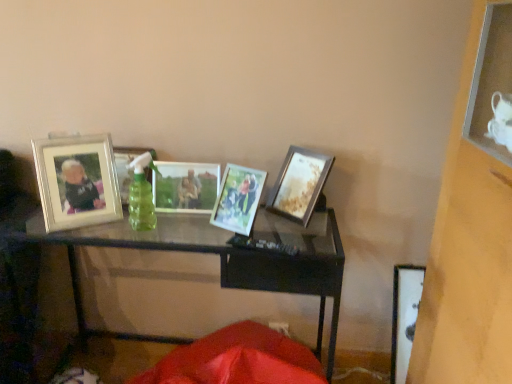
Question: Is the depth of wooden photo frame at center, the 1th picture frame when ordered from right to left, greater than that of metallic silver photo frame at center, which is the 3th picture frame from left to right?

Choices:
 (A) yes
 (B) no

Answer: (B)

Question: Can you confirm if wooden photo frame at center, the 1th picture frame when ordered from right to left, is positioned to the right of metallic silver photo frame at center, which is the 3th picture frame from left to right?

Choices:
 (A) no
 (B) yes

Answer: (B)

Question: Is wooden photo frame at center, the fifth picture frame positioned from the left, thinner than metallic silver photo frame at center, which is the 3th picture frame from left to right?

Choices:
 (A) yes
 (B) no

Answer: (B)

Question: From a real-world perspective, is wooden photo frame at center, the 1th picture frame when ordered from right to left, over metallic silver photo frame at center, which is the 3th picture frame from left to right?

Choices:
 (A) yes
 (B) no

Answer: (A)

Question: From the image's perspective, is wooden photo frame at center, the 1th picture frame when ordered from right to left, on top of metallic silver photo frame at center, positioned as the 3th picture frame in right-to-left order?

Choices:
 (A) no
 (B) yes

Answer: (B)

Question: Is wooden photo frame at center, the fifth picture frame positioned from the left, shorter than metallic silver photo frame at center, which is the 3th picture frame from left to right?

Choices:
 (A) no
 (B) yes

Answer: (A)

Question: Does black glass table at center lie in front of metallic silver photo frame at center, which is the 3th picture frame from left to right?

Choices:
 (A) yes
 (B) no

Answer: (A)

Question: From the image's perspective, does black glass table at center appear higher than metallic silver photo frame at center, which is the 3th picture frame from left to right?

Choices:
 (A) no
 (B) yes

Answer: (A)

Question: Is the depth of black glass table at center greater than that of metallic silver photo frame at center, which is the 3th picture frame from left to right?

Choices:
 (A) no
 (B) yes

Answer: (A)

Question: Considering the relative sizes of black glass table at center and metallic silver photo frame at center, positioned as the 3th picture frame in right-to-left order, in the image provided, is black glass table at center wider than metallic silver photo frame at center, positioned as the 3th picture frame in right-to-left order,?

Choices:
 (A) no
 (B) yes

Answer: (B)

Question: Does black glass table at center turn towards metallic silver photo frame at center, which is the 3th picture frame from left to right?

Choices:
 (A) yes
 (B) no

Answer: (B)

Question: Would you say black glass table at center contains metallic silver photo frame at center, which is the 3th picture frame from left to right?

Choices:
 (A) no
 (B) yes

Answer: (A)

Question: Considering the relative sizes of metallic silver photo frame at center, positioned as the 3th picture frame in right-to-left order, and metallic silver photo frame at center, which is the fourth picture frame from left to right, in the image provided, is metallic silver photo frame at center, positioned as the 3th picture frame in right-to-left order, thinner than metallic silver photo frame at center, which is the fourth picture frame from left to right,?

Choices:
 (A) no
 (B) yes

Answer: (B)